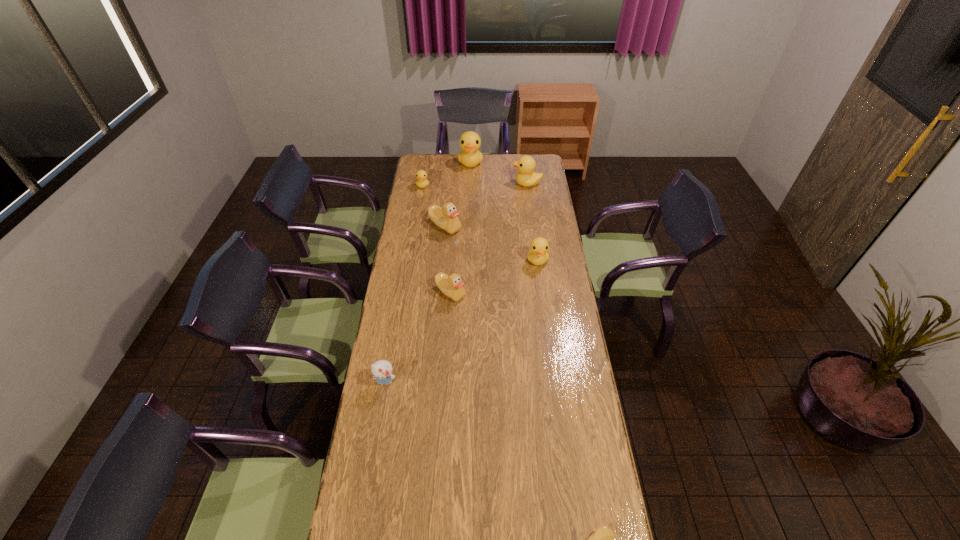
In order to click on the farthest duck in this screenshot , I will do `click(470, 156)`.

Where is `the tallest object`? the tallest object is located at coordinates (470, 156).

The width and height of the screenshot is (960, 540). Identify the location of the second biggest yellow duck. (526, 164).

Where is `the fourth farthest object`? This screenshot has width=960, height=540. the fourth farthest object is located at coordinates (446, 218).

Locate an element on the screen. This screenshot has height=540, width=960. the farthest beige duck is located at coordinates (446, 218).

Find the location of a particular element. This screenshot has width=960, height=540. the fourth nearest object is located at coordinates (538, 255).

Where is `the nearest yellow duck`? The height and width of the screenshot is (540, 960). the nearest yellow duck is located at coordinates (538, 255).

Image resolution: width=960 pixels, height=540 pixels. What are the coordinates of `the second nearest beige duck` in the screenshot? It's located at click(x=452, y=286).

Image resolution: width=960 pixels, height=540 pixels. I want to click on the third nearest object, so click(x=452, y=286).

This screenshot has height=540, width=960. Find the location of `the seventh farthest object`. the seventh farthest object is located at coordinates (382, 370).